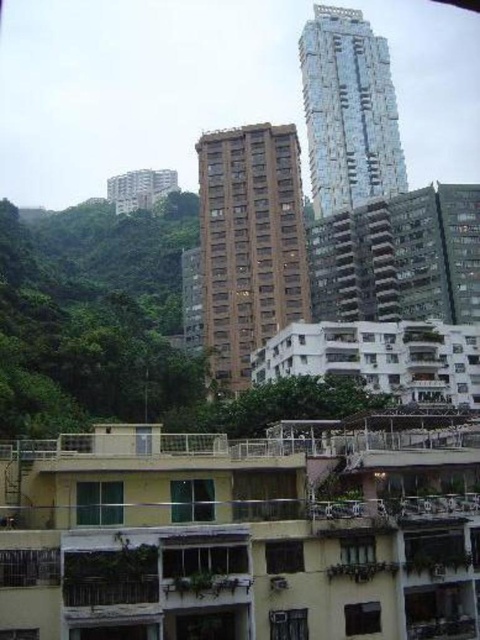
Question: Is brown textured building at center closer to camera compared to glassy reflective building at upper center?

Choices:
 (A) yes
 (B) no

Answer: (A)

Question: Does brown textured building at center appear under glassy reflective building at upper center?

Choices:
 (A) no
 (B) yes

Answer: (B)

Question: Which point appears farthest from the camera in this image?

Choices:
 (A) (377, 36)
 (B) (218, 371)

Answer: (A)

Question: Can you confirm if brown textured building at center is thinner than glassy reflective building at upper center?

Choices:
 (A) no
 (B) yes

Answer: (B)

Question: Which point is farther to the camera?

Choices:
 (A) (345, 68)
 (B) (244, 234)

Answer: (A)